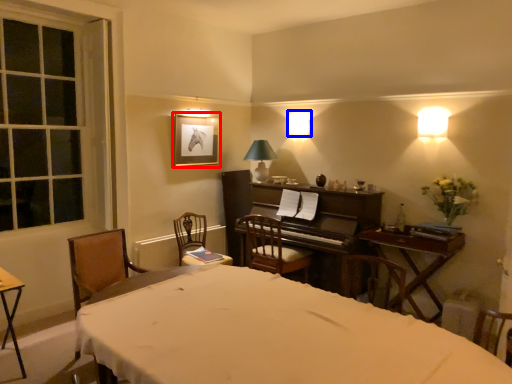
Question: Which point is further to the camera, picture frame (highlighted by a red box) or lamp (highlighted by a blue box)?

Choices:
 (A) picture frame
 (B) lamp

Answer: (B)